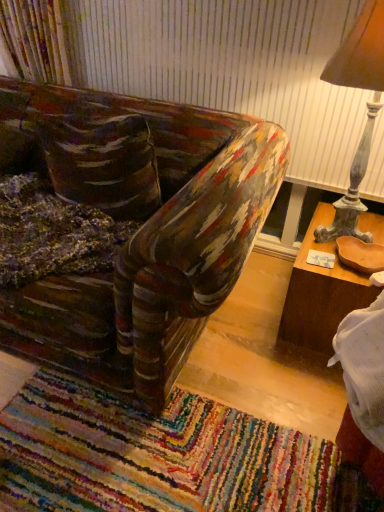
The height and width of the screenshot is (512, 384). In order to click on wooden lampshade at right in this screenshot , I will do `click(367, 109)`.

Measure the distance between point (331, 204) and camera.

Point (331, 204) and camera are 6.16 feet apart.

This screenshot has width=384, height=512. Describe the element at coordinates (321, 293) in the screenshot. I see `brown wood table at right` at that location.

The image size is (384, 512). I want to click on wooden lampshade at right, so click(367, 109).

Is wooden lampshade at right situated inside brown wood table at right or outside?

wooden lampshade at right is not enclosed by brown wood table at right.

From the image's perspective, which one is positioned higher, wooden lampshade at right or brown wood table at right?

wooden lampshade at right appears higher in the image.

In terms of height, does wooden lampshade at right look taller or shorter compared to brown wood table at right?

Clearly, wooden lampshade at right is taller compared to brown wood table at right.

Is wooden lampshade at right wider or thinner than brown wood table at right?

In the image, wooden lampshade at right appears to be more narrow than brown wood table at right.

Locate an element on the screen. This screenshot has width=384, height=512. table that is above the multicolored woven mat at lower center (from the image's perspective) is located at coordinates (321, 293).

Is brown wood table at right oriented towards multicolored woven mat at lower center?

Yes, brown wood table at right is facing multicolored woven mat at lower center.

How far apart are brown wood table at right and multicolored woven mat at lower center?

A distance of 25.88 inches exists between brown wood table at right and multicolored woven mat at lower center.

Can you tell me how much brown wood table at right and multicolored woven mat at lower center differ in facing direction?

brown wood table at right and multicolored woven mat at lower center are facing 89 degrees away from each other.

How far apart are wooden lampshade at right and multicolored woven mat at lower center?

wooden lampshade at right and multicolored woven mat at lower center are 3.37 feet apart from each other.

Between wooden lampshade at right and multicolored woven mat at lower center, which one appears on the left side from the viewer's perspective?

Positioned to the left is multicolored woven mat at lower center.

From a real-world perspective, is wooden lampshade at right located beneath multicolored woven mat at lower center?

No, from a real-world perspective, wooden lampshade at right is not under multicolored woven mat at lower center.

From the image's perspective, which is below, wooden lampshade at right or multicolored woven mat at lower center?

From the image's view, multicolored woven mat at lower center is below.

Between point (177, 411) and point (288, 322), which one is positioned behind?

Point (288, 322)

At what (x,y) coordinates should I click in order to perform the action: click on mat below the brown wood table at right (from the image's perspective). Please return your answer as a coordinate pair (x, y). Looking at the image, I should click on (154, 455).

From the image's perspective, would you say multicolored woven mat at lower center is positioned over brown wood table at right?

No.

Does brown wood table at right turn towards wooden lampshade at right?

No.

Is point (370, 293) closer to viewer compared to point (361, 52)?

No, it is not.

In the scene shown: Considering the relative sizes of brown wood table at right and wooden lampshade at right in the image provided, is brown wood table at right taller than wooden lampshade at right?

No.

From a real-world perspective, which object rests below the other?

brown wood table at right.

The image size is (384, 512). I want to click on table lamp above the multicolored woven mat at lower center (from a real-world perspective), so point(367,109).

Considering the sizes of multicolored woven mat at lower center and wooden lampshade at right in the image, is multicolored woven mat at lower center bigger or smaller than wooden lampshade at right?

Considering their sizes, multicolored woven mat at lower center takes up less space than wooden lampshade at right.

Is the depth of multicolored woven mat at lower center greater than that of wooden lampshade at right?

No, multicolored woven mat at lower center is closer to the camera.

Based on the photo, from the image's perspective, which object appears higher, multicolored woven mat at lower center or wooden lampshade at right?

wooden lampshade at right is shown above in the image.

Find the location of a particular element. The width and height of the screenshot is (384, 512). table lamp in front of the brown wood table at right is located at coordinates (367, 109).

Where is `mat directly beneath the brown wood table at right (from a real-world perspective)`? This screenshot has height=512, width=384. mat directly beneath the brown wood table at right (from a real-world perspective) is located at coordinates (154, 455).

Looking at the image, which one is located further to wooden lampshade at right, multicolored woven mat at lower center or brown wood table at right?

multicolored woven mat at lower center lies further to wooden lampshade at right than the other object.

When comparing their distances from multicolored woven mat at lower center, does wooden lampshade at right or brown wood table at right seem further?

The object further to multicolored woven mat at lower center is wooden lampshade at right.

In the scene shown: When comparing their distances from wooden lampshade at right, does brown wood table at right or multicolored woven mat at lower center seem closer?

brown wood table at right.

Looking at the image, which one is located further to multicolored woven mat at lower center, brown wood table at right or wooden lampshade at right?

The object further to multicolored woven mat at lower center is wooden lampshade at right.

From the image, which object appears to be nearer to brown wood table at right, wooden lampshade at right or multicolored woven mat at lower center?

wooden lampshade at right lies closer to brown wood table at right than the other object.

Considering their positions, is multicolored woven mat at lower center positioned further to brown wood table at right than wooden lampshade at right?

multicolored woven mat at lower center is further to brown wood table at right.

I want to click on table between wooden lampshade at right and multicolored woven mat at lower center from top to bottom, so click(x=321, y=293).